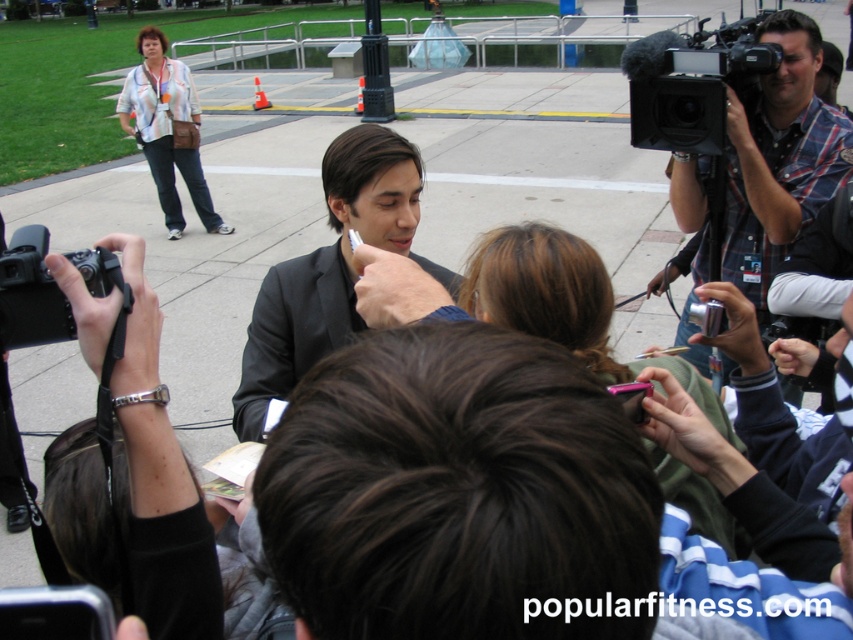
Question: Is the position of black matte suit at center more distant than that of black plastic video camera at upper right?

Choices:
 (A) yes
 (B) no

Answer: (B)

Question: Where is black plastic video camera at upper right located in relation to black plastic camera at lower left in the image?

Choices:
 (A) below
 (B) above

Answer: (B)

Question: Considering the real-world distances, which object is closest to the black matte suit at center?

Choices:
 (A) striped shirt at upper left
 (B) black plastic camera at lower left
 (C) black plastic video camera at upper right
 (D) blue fabric shirt at center

Answer: (C)

Question: Does black plastic video camera at upper right appear on the left side of black plastic camera at lower left?

Choices:
 (A) yes
 (B) no

Answer: (B)

Question: Which point is farther from the camera taking this photo?

Choices:
 (A) (824, 118)
 (B) (347, 324)
 (C) (722, 614)

Answer: (A)

Question: Which of the following is the closest to the observer?

Choices:
 (A) (711, 120)
 (B) (141, 109)

Answer: (A)